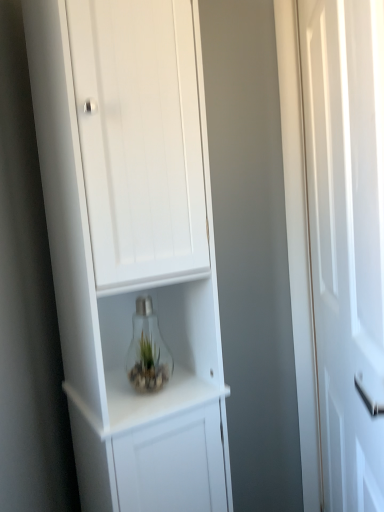
Question: Relative to white glossy door at right, is clear glass bulb at center in front or behind?

Choices:
 (A) front
 (B) behind

Answer: (B)

Question: From their relative heights in the image, would you say clear glass bulb at center is taller or shorter than white glossy door at right?

Choices:
 (A) tall
 (B) short

Answer: (B)

Question: Which object is the farthest from the white matte cabinet at center?

Choices:
 (A) clear glass bulb at center
 (B) white glossy door at right

Answer: (B)

Question: Considering the real-world distances, which object is farthest from the white glossy door at right?

Choices:
 (A) white matte cabinet at center
 (B) clear glass bulb at center

Answer: (B)